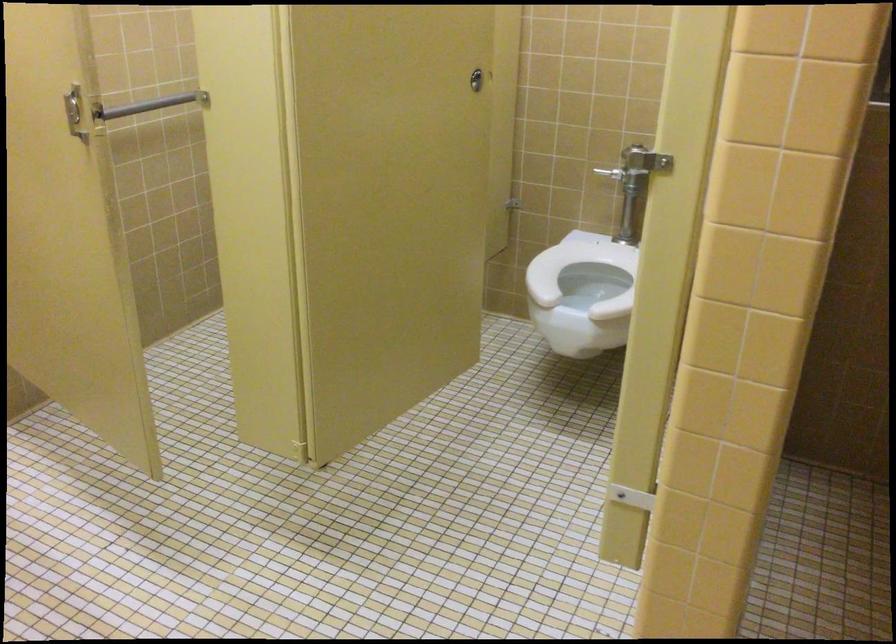
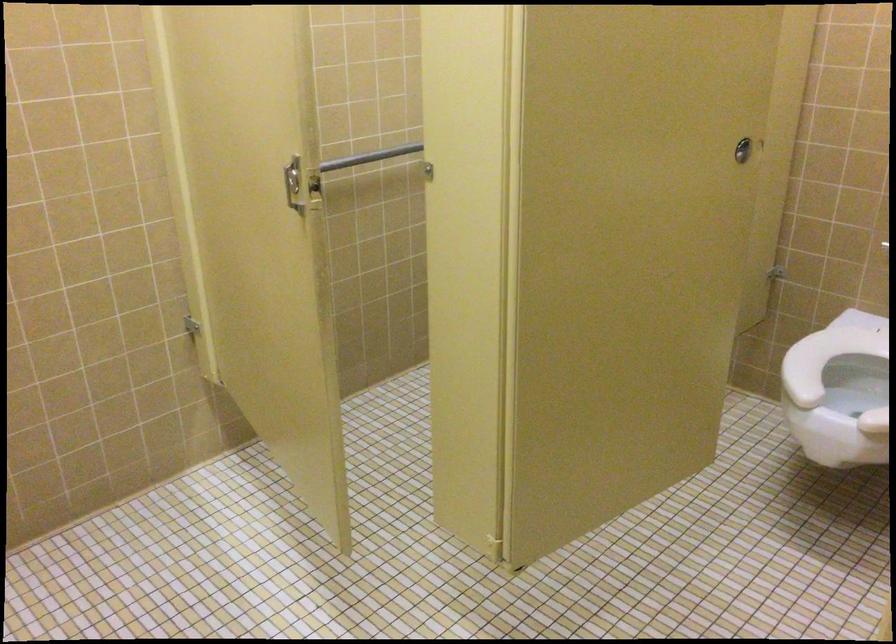
In the second image, find the point that corresponds to point (477, 87) in the first image.

(743, 149)